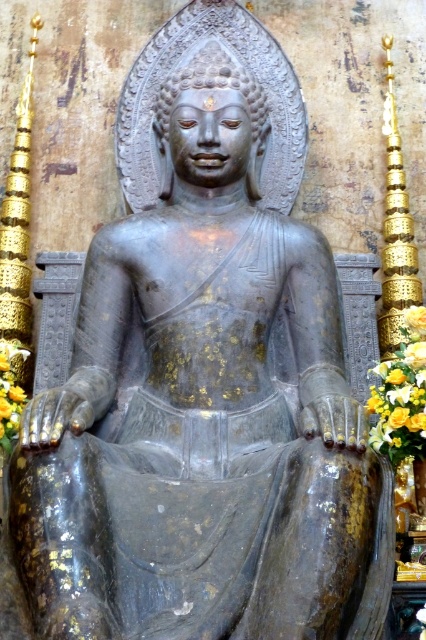
Question: In this image, where is yellow silk flower at lower right located relative to yellow fabric at lower left?

Choices:
 (A) below
 (B) above

Answer: (B)

Question: Which point appears closest to the camera in this image?

Choices:
 (A) (408, 380)
 (B) (3, 440)

Answer: (A)

Question: Among these points, which one is nearest to the camera?

Choices:
 (A) (0, 444)
 (B) (419, 333)

Answer: (A)

Question: Does yellow silk flower at lower right come in front of yellow fabric at lower left?

Choices:
 (A) no
 (B) yes

Answer: (B)

Question: Is yellow silk flower at lower right above yellow fabric at lower left?

Choices:
 (A) yes
 (B) no

Answer: (A)